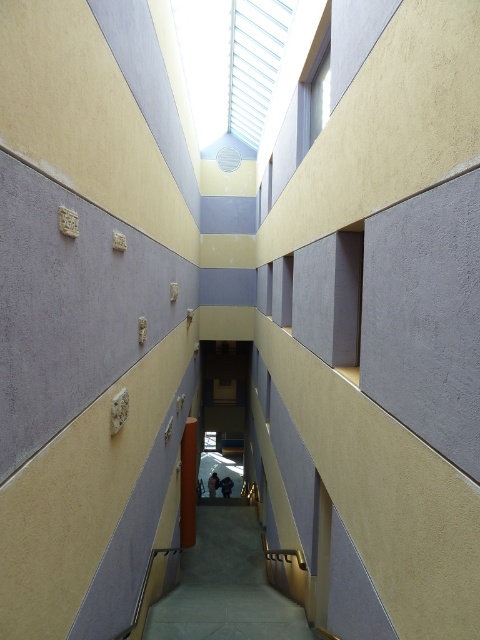
You are an architect evaluating the structural integrity of the space. Considering the smooth concrete stairs at center and the smooth brown wooden pillar at center, which one has a greater height?

The smooth brown wooden pillar at center is taller than the smooth concrete stairs at center.

You are standing in the modern architectural space shown in the image. You need to locate the smooth concrete stairs at center. According to the coordinates provided, where exactly are they positioned?

The smooth concrete stairs at center are located at point coordinates of (x=226, y=586).

You are standing at the entrance of this modern atrium and want to go upstairs. The smooth brown wooden pillar at center is blocking your path to the smooth concrete stairs at center. Can you walk around the pillar to reach the stairs?

The smooth concrete stairs at center is positioned under the smooth brown wooden pillar at center, so the pillar is directly above the stairs. This means the pillar is not blocking your path, so you can walk straight to the stairs without needing to go around the pillar.